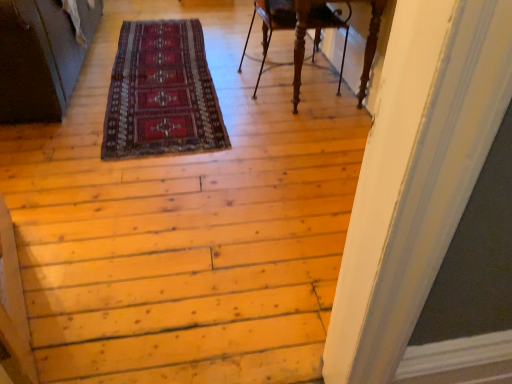
Question: Considering the positions of wooden carved chair at upper center and red woolen rug at center in the image, is wooden carved chair at upper center taller or shorter than red woolen rug at center?

Choices:
 (A) short
 (B) tall

Answer: (B)

Question: Looking at their shapes, would you say wooden carved chair at upper center is wider or thinner than red woolen rug at center?

Choices:
 (A) thin
 (B) wide

Answer: (A)

Question: Considering their positions, is wooden carved chair at upper center located in front of or behind red woolen rug at center?

Choices:
 (A) front
 (B) behind

Answer: (B)

Question: In the image, is red woolen rug at center on the left side or the right side of wooden carved chair at upper center?

Choices:
 (A) right
 (B) left

Answer: (B)

Question: Considering their positions, is red woolen rug at center located in front of or behind wooden carved chair at upper center?

Choices:
 (A) front
 (B) behind

Answer: (A)

Question: From a real-world perspective, is red woolen rug at center positioned above or below wooden carved chair at upper center?

Choices:
 (A) above
 (B) below

Answer: (B)

Question: Is point (189, 77) positioned closer to the camera than point (289, 18)?

Choices:
 (A) farther
 (B) closer

Answer: (A)